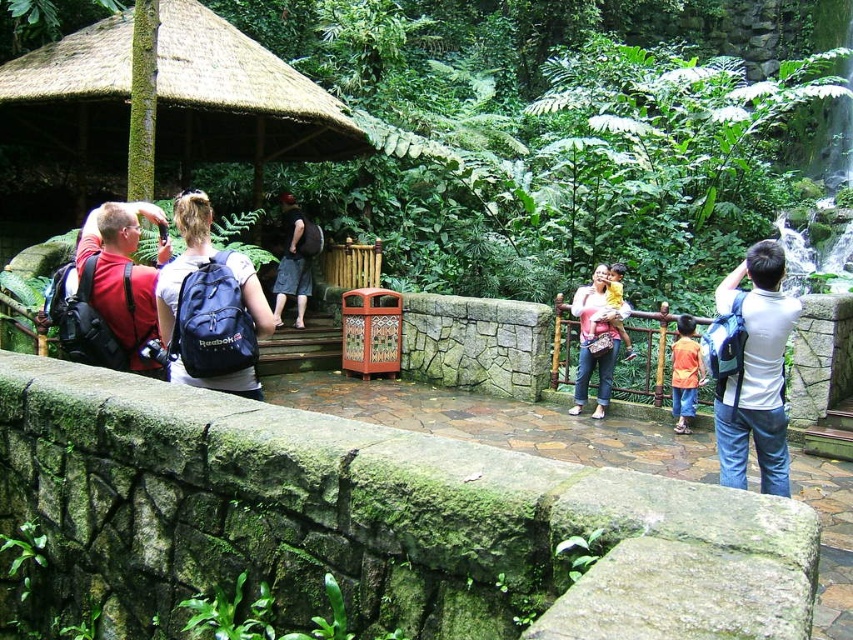
Question: Which object appears farthest from the camera in this image?

Choices:
 (A) orange fabric shirt at center
 (B) pink fabric purse at center
 (C) matte red backpack at left

Answer: (B)

Question: Observing the image, what is the correct spatial positioning of green mossy stone ledge at lower left in reference to matte red backpack at left?

Choices:
 (A) left
 (B) right

Answer: (B)

Question: Considering the real-world distances, which object is closest to the white fabric backpack at right?

Choices:
 (A) black fabric backpack at center
 (B) matte red backpack at left
 (C) orange fabric shirt at center

Answer: (C)

Question: Can you confirm if white fabric backpack at right is positioned below black fabric backpack at center?

Choices:
 (A) yes
 (B) no

Answer: (A)

Question: Which object appears farthest from the camera in this image?

Choices:
 (A) white fabric backpack at right
 (B) orange fabric shirt at center
 (C) blue fabric backpack at center

Answer: (B)

Question: Is blue fabric backpack at center bigger than pink fabric purse at center?

Choices:
 (A) yes
 (B) no

Answer: (B)